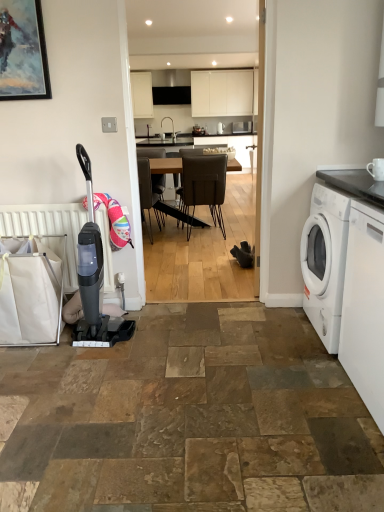
Question: Which direction should I rotate to look at white matte cabinet at upper center, the 2th cabinetry positioned from the left?

Choices:
 (A) left
 (B) right

Answer: (B)

Question: Can brown leather chair at center be found inside white matte washing machine at right, the 2th washing machine in the front-to-back sequence?

Choices:
 (A) no
 (B) yes

Answer: (A)

Question: From a real-world perspective, is white matte washing machine at right, the 2th washing machine in the front-to-back sequence, positioned under brown leather chair at center based on gravity?

Choices:
 (A) no
 (B) yes

Answer: (B)

Question: Is white matte washing machine at right, the 2th washing machine in the front-to-back sequence, wider than brown leather chair at center?

Choices:
 (A) no
 (B) yes

Answer: (A)

Question: Can you confirm if white matte washing machine at right, the 1th washing machine viewed from the back, is positioned to the left of brown leather chair at center?

Choices:
 (A) yes
 (B) no

Answer: (B)

Question: From the image's perspective, is white matte washing machine at right, the 2th washing machine in the front-to-back sequence, on top of brown leather chair at center?

Choices:
 (A) no
 (B) yes

Answer: (A)

Question: Can you confirm if white matte washing machine at right, the 2th washing machine in the front-to-back sequence, is thinner than brown leather chair at center?

Choices:
 (A) yes
 (B) no

Answer: (A)

Question: Can you confirm if metallic painting at upper left is positioned to the right of black matte exhaust hood at upper center?

Choices:
 (A) no
 (B) yes

Answer: (A)

Question: Is black matte exhaust hood at upper center completely or partially inside metallic painting at upper left?

Choices:
 (A) no
 (B) yes

Answer: (A)

Question: Does metallic painting at upper left have a larger size compared to black matte exhaust hood at upper center?

Choices:
 (A) yes
 (B) no

Answer: (B)

Question: Does metallic painting at upper left appear on the left side of black matte exhaust hood at upper center?

Choices:
 (A) no
 (B) yes

Answer: (B)

Question: Can you confirm if metallic painting at upper left is taller than black matte exhaust hood at upper center?

Choices:
 (A) no
 (B) yes

Answer: (A)

Question: Is the position of metallic painting at upper left more distant than that of black matte exhaust hood at upper center?

Choices:
 (A) yes
 (B) no

Answer: (B)

Question: Is white matte radiator at left to the left of white glossy washing machine at right, which appears as the 2th washing machine when viewed from the back, from the viewer's perspective?

Choices:
 (A) no
 (B) yes

Answer: (B)